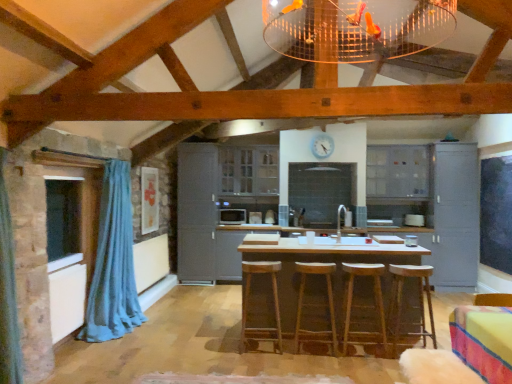
Locate an element on the screen. vacant area located to the right-hand side of blue fabric curtain at left is located at coordinates (165, 331).